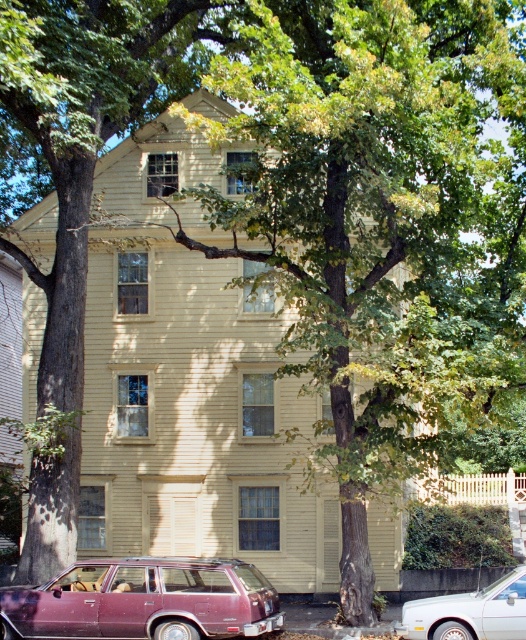
Between point (86, 621) and point (427, 611), which one is positioned in front?

Point (427, 611) is more forward.

Is point (160, 621) behind point (490, 602)?

That is True.

Does point (173, 620) come farther from viewer compared to point (520, 600)?

Yes, it is.

You are a GUI agent. You are given a task and a screenshot of the screen. Output one action in this format:
    pyautogui.click(x=<x>, y=<y>)
    Task: Click on the maroon metallic station wagon at lower left
    The image size is (526, 640).
    Given the screenshot: What is the action you would take?
    pyautogui.click(x=145, y=600)